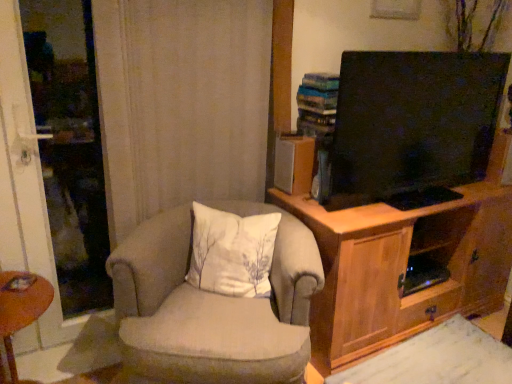
Find the location of `white fabric pillow at center`. white fabric pillow at center is located at coordinates (232, 252).

Image resolution: width=512 pixels, height=384 pixels. Identify the location of wooden cabinet at right. (387, 270).

This screenshot has width=512, height=384. In order to click on brown wooden desk at lower left in this screenshot , I will do `click(21, 307)`.

Is point (19, 304) closer or farther from the camera than point (253, 234)?

Point (19, 304).

Does brown wooden desk at lower left have a greater width compared to white fabric pillow at center?

Correct, the width of brown wooden desk at lower left exceeds that of white fabric pillow at center.

Between brown wooden desk at lower left and white fabric pillow at center, which one appears on the left side from the viewer's perspective?

From the viewer's perspective, brown wooden desk at lower left appears more on the left side.

Is brown wooden desk at lower left bigger than white fabric pillow at center?

Actually, brown wooden desk at lower left might be smaller than white fabric pillow at center.

Considering the positions of points (401, 251) and (191, 269), is point (401, 251) closer to camera compared to point (191, 269)?

No, (401, 251) is behind (191, 269).

Is wooden cabinet at right with white fabric pillow at center?

They are not placed beside each other.

Which object is further away from the camera taking this photo, wooden cabinet at right or white fabric pillow at center?

wooden cabinet at right is more distant.

From the image's perspective, is wooden cabinet at right above or below beige fabric chair at center?

Clearly, from the image's perspective, wooden cabinet at right is above beige fabric chair at center.

Find the location of a particular element. Image resolution: width=512 pixels, height=384 pixels. chair on the left of wooden cabinet at right is located at coordinates (212, 306).

Can you confirm if wooden cabinet at right is thinner than beige fabric chair at center?

In fact, wooden cabinet at right might be wider than beige fabric chair at center.

Which object is further away from the camera taking this photo, wooden cabinet at right or beige fabric chair at center?

wooden cabinet at right.

Is beige fabric chair at center placed right next to wooden cabinet at right?

beige fabric chair at center is not next to wooden cabinet at right, and they're not touching.

Is beige fabric chair at center facing towards wooden cabinet at right?

No.

From the image's perspective, is beige fabric chair at center above or below wooden cabinet at right?

Clearly, from the image's perspective, beige fabric chair at center is below wooden cabinet at right.

From a real-world perspective, is beige fabric chair at center beneath white fabric pillow at center?

Yes, from a real-world perspective, beige fabric chair at center is below white fabric pillow at center.

Looking at their sizes, would you say beige fabric chair at center is wider or thinner than white fabric pillow at center?

In the image, beige fabric chair at center appears to be wider than white fabric pillow at center.

Which of these two, beige fabric chair at center or white fabric pillow at center, is bigger?

With larger size is beige fabric chair at center.

From the picture: Is beige fabric chair at center positioned beyond the bounds of white fabric pillow at center?

Yes, beige fabric chair at center is located beyond the bounds of white fabric pillow at center.

Looking at their sizes, would you say brown wooden desk at lower left is wider or thinner than wooden cabinet at right?

brown wooden desk at lower left is thinner than wooden cabinet at right.

What's the angular difference between brown wooden desk at lower left and wooden cabinet at right's facing directions?

93.7 degrees separate the facing orientations of brown wooden desk at lower left and wooden cabinet at right.

Can you confirm if brown wooden desk at lower left is bigger than wooden cabinet at right?

Actually, brown wooden desk at lower left might be smaller than wooden cabinet at right.

Could you tell me if white fabric pillow at center is facing beige fabric chair at center?

Yes, white fabric pillow at center is facing beige fabric chair at center.

Is white fabric pillow at center wider than beige fabric chair at center?

In fact, white fabric pillow at center might be narrower than beige fabric chair at center.

Is white fabric pillow at center bigger than beige fabric chair at center?

Actually, white fabric pillow at center might be smaller than beige fabric chair at center.

Which is behind, white fabric pillow at center or beige fabric chair at center?

Positioned behind is white fabric pillow at center.

Where is `desk in front of the white fabric pillow at center`? desk in front of the white fabric pillow at center is located at coordinates (21, 307).

The height and width of the screenshot is (384, 512). Identify the location of cabinetry lying behind the white fabric pillow at center. (387, 270).

Based on their spatial positions, is wooden cabinet at right or white fabric pillow at center further from beige fabric chair at center?

wooden cabinet at right is positioned further to the anchor beige fabric chair at center.

Which object lies nearer to the anchor point beige fabric chair at center, brown wooden desk at lower left or white fabric pillow at center?

Among the two, white fabric pillow at center is located nearer to beige fabric chair at center.

Looking at the image, which one is located further to brown wooden desk at lower left, wooden cabinet at right or beige fabric chair at center?

Among the two, wooden cabinet at right is located further to brown wooden desk at lower left.

Considering their positions, is wooden cabinet at right positioned further to white fabric pillow at center than brown wooden desk at lower left?

Based on the image, brown wooden desk at lower left appears to be further to white fabric pillow at center.

Which object lies further to the anchor point beige fabric chair at center, brown wooden desk at lower left or wooden cabinet at right?

brown wooden desk at lower left is positioned further to the anchor beige fabric chair at center.

Considering their positions, is beige fabric chair at center positioned closer to wooden cabinet at right than brown wooden desk at lower left?

beige fabric chair at center is positioned closer to the anchor wooden cabinet at right.

Based on their spatial positions, is white fabric pillow at center or beige fabric chair at center closer to brown wooden desk at lower left?

beige fabric chair at center is positioned closer to the anchor brown wooden desk at lower left.

Which object lies further to the anchor point wooden cabinet at right, white fabric pillow at center or beige fabric chair at center?

Based on the image, beige fabric chair at center appears to be further to wooden cabinet at right.

The image size is (512, 384). What are the coordinates of `chair situated between brown wooden desk at lower left and white fabric pillow at center from left to right` in the screenshot? It's located at tap(212, 306).

Locate an element on the screen. The width and height of the screenshot is (512, 384). chair between brown wooden desk at lower left and wooden cabinet at right in the horizontal direction is located at coordinates (212, 306).

In order to click on pillow between beige fabric chair at center and wooden cabinet at right from left to right in this screenshot , I will do `click(232, 252)`.

Find the location of `pillow located between brown wooden desk at lower left and wooden cabinet at right in the left-right direction`. pillow located between brown wooden desk at lower left and wooden cabinet at right in the left-right direction is located at coordinates (232, 252).